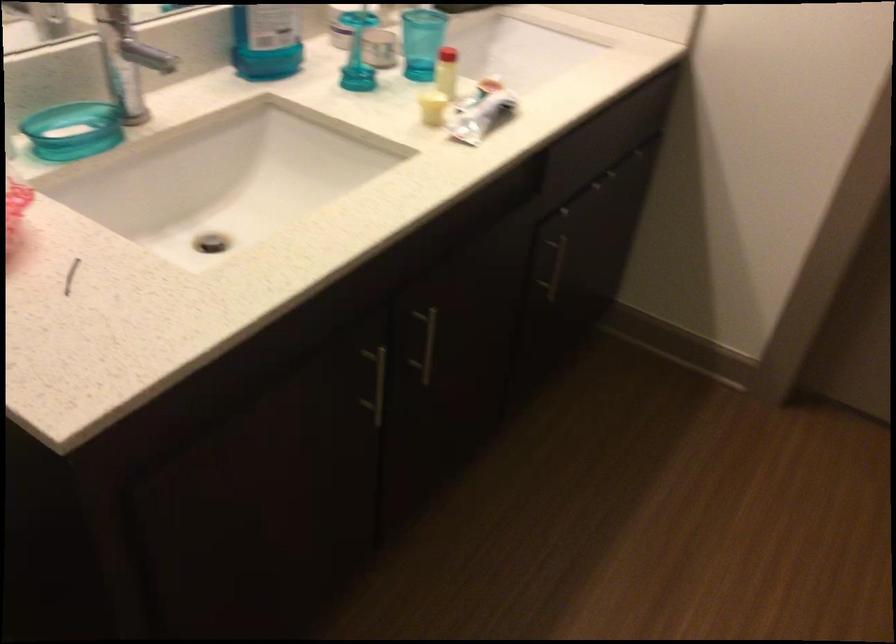
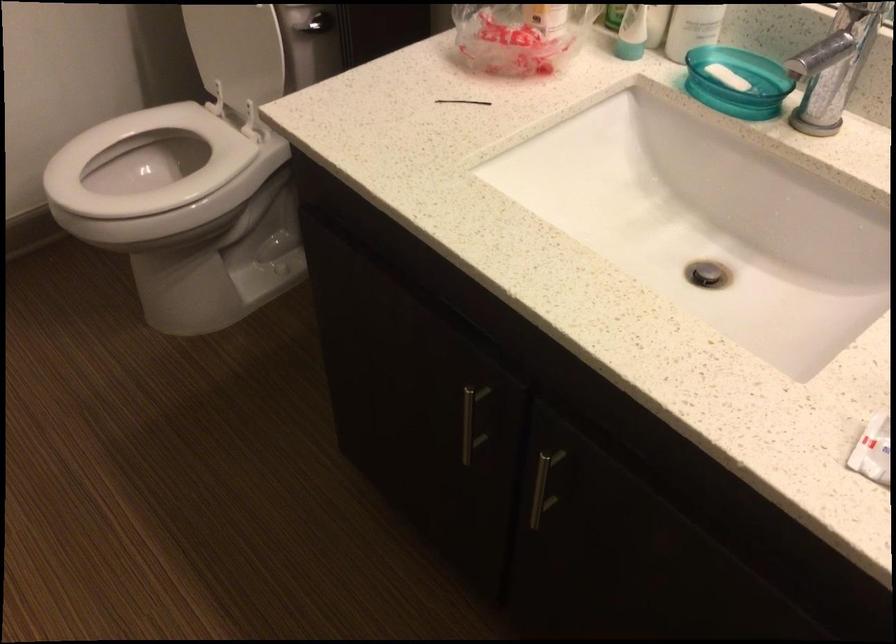
In the second image, find the point that corresponds to point 416,352 in the first image.

(543, 486)